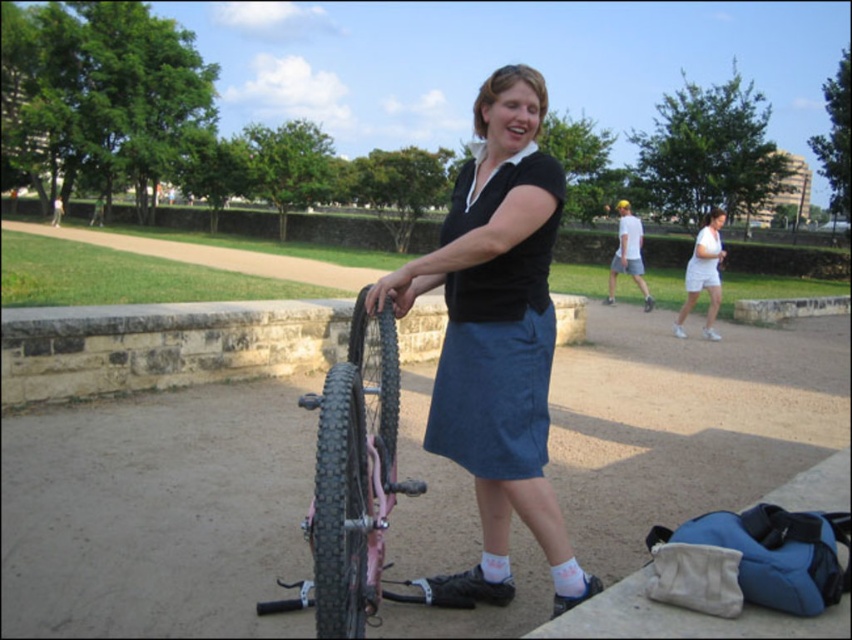
Question: Estimate the real-world distances between objects in this image. Which object is closer to the black rubber tire at center?

Choices:
 (A) pink matte bicycle at center
 (B) matte black shirt at center

Answer: (A)

Question: Which point is farther from the camera taking this photo?

Choices:
 (A) (337, 531)
 (B) (338, 426)

Answer: (B)

Question: Can you confirm if blue cotton dress at center is positioned to the right of white cotton shorts at right?

Choices:
 (A) no
 (B) yes

Answer: (A)

Question: Is black rubber tire at center smaller than white cotton shorts at right?

Choices:
 (A) no
 (B) yes

Answer: (B)

Question: Does blue cotton dress at center appear over black rubber tire at center?

Choices:
 (A) yes
 (B) no

Answer: (A)

Question: Which point is closer to the camera?

Choices:
 (A) pink matte bicycle at center
 (B) black rubber tire at center
 (C) white cotton dress at center

Answer: (A)